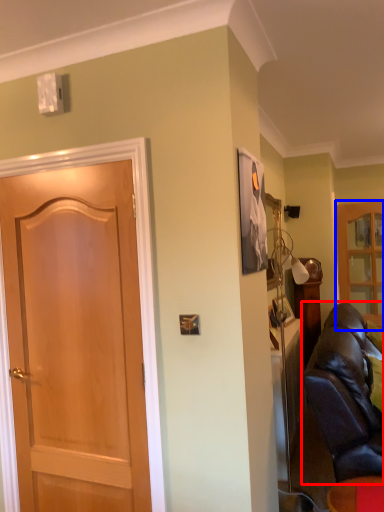
Question: Among these objects, which one is farthest to the camera, studio couch (highlighted by a red box) or cabinetry (highlighted by a blue box)?

Choices:
 (A) studio couch
 (B) cabinetry

Answer: (B)